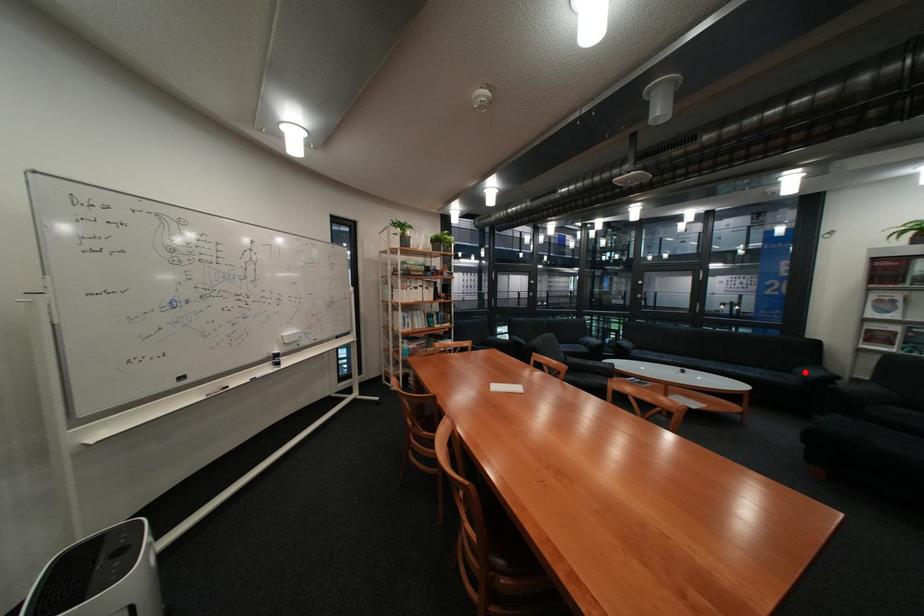
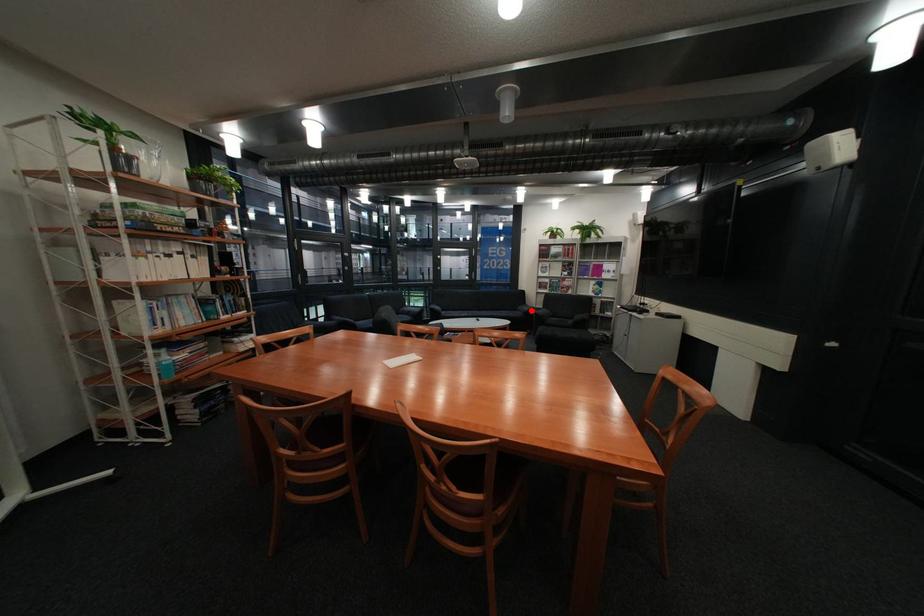
I am providing you with two images of the same scene from different viewpoints. A red point is marked on the first image and another point is marked on the second image. Is the marked point in image1 the same physical position as the marked point in image2?

Yes